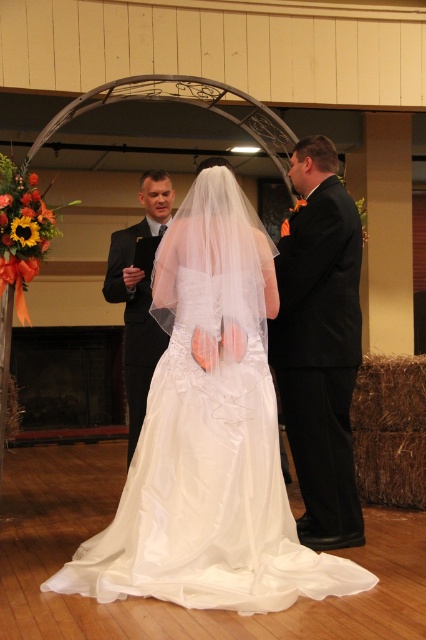
Is white satin dress at center to the left of dark gray suit at center from the viewer's perspective?

No, white satin dress at center is not to the left of dark gray suit at center.

Is point (135, 497) behind point (147, 304)?

No, it is in front of (147, 304).

Identify the location of white satin dress at center. The image size is (426, 640). (206, 509).

The height and width of the screenshot is (640, 426). Describe the element at coordinates (206, 509) in the screenshot. I see `white satin dress at center` at that location.

Can you confirm if white satin dress at center is positioned below black satin suit at right?

Correct, white satin dress at center is located below black satin suit at right.

Identify the location of white satin dress at center. Image resolution: width=426 pixels, height=640 pixels. (206, 509).

Image resolution: width=426 pixels, height=640 pixels. I want to click on white satin dress at center, so click(206, 509).

Can you confirm if black satin suit at right is positioned to the right of dark gray suit at center?

Correct, you'll find black satin suit at right to the right of dark gray suit at center.

What do you see at coordinates (319, 342) in the screenshot? I see `black satin suit at right` at bounding box center [319, 342].

Image resolution: width=426 pixels, height=640 pixels. What are the coordinates of `black satin suit at right` in the screenshot? It's located at 319,342.